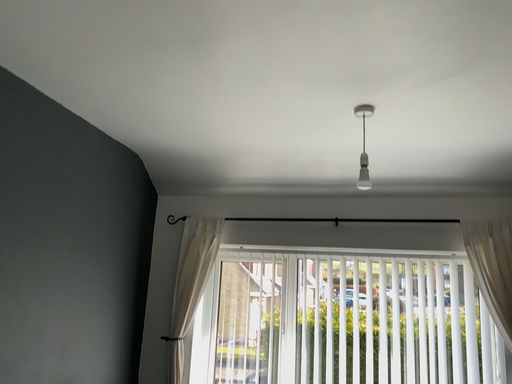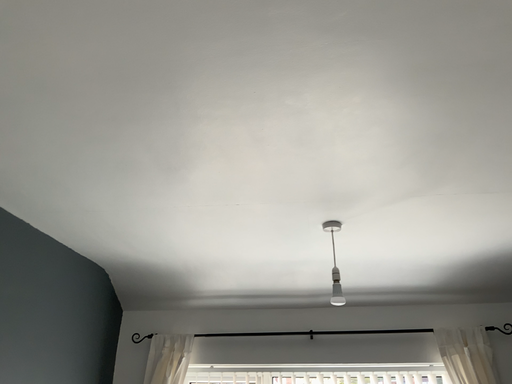
Question: Which way did the camera rotate in the video?

Choices:
 (A) rotated downward
 (B) rotated upward

Answer: (B)